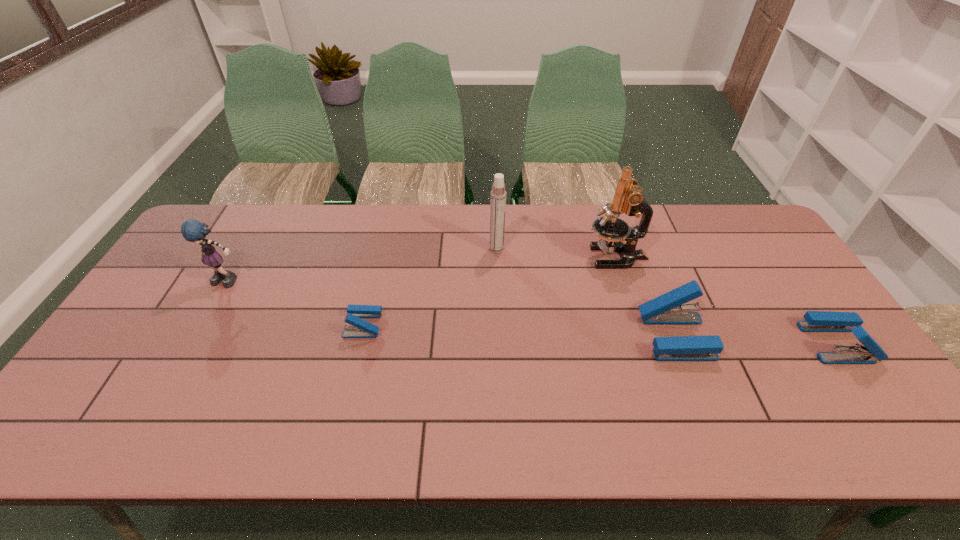
Image resolution: width=960 pixels, height=540 pixels. Find the location of `object that is at the left edge`. object that is at the left edge is located at coordinates 192,230.

Locate an element on the screen. The image size is (960, 540). object located in the right edge section of the desktop is located at coordinates (816, 321).

Locate an element on the screen. The image size is (960, 540). vacant area at the far edge is located at coordinates (586, 228).

Locate an element on the screen. The image size is (960, 540). free region at the near edge of the desktop is located at coordinates (756, 394).

The image size is (960, 540). Find the location of `vacant position at the left edge of the desktop`. vacant position at the left edge of the desktop is located at coordinates (199, 287).

At what (x,y) coordinates should I click in order to perform the action: click on vacant space at the far right corner of the desktop. Please return your answer as a coordinate pair (x, y). The width and height of the screenshot is (960, 540). Looking at the image, I should click on (706, 208).

You are a GUI agent. You are given a task and a screenshot of the screen. Output one action in this format:
    pyautogui.click(x=<x>, y=<y>)
    Task: Click on the blank space at the near right corner of the desktop
    
    Given the screenshot: What is the action you would take?
    pyautogui.click(x=828, y=397)

At what (x,y) coordinates should I click in order to perform the action: click on free space between the second stapler from right to left and the microscope. Please return your answer as a coordinate pair (x, y). The width and height of the screenshot is (960, 540). Looking at the image, I should click on (645, 297).

The image size is (960, 540). Identify the location of free space between the third object from left to right and the shortest stapler. (430, 287).

Locate an element on the screen. unoccupied position between the microscope and the leftmost stapler is located at coordinates (490, 291).